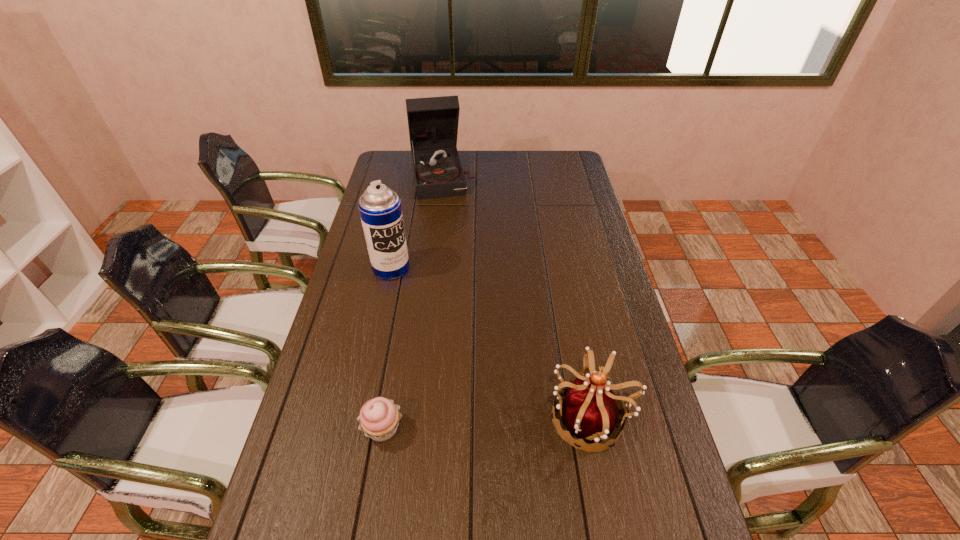
Where is `vacant space on the desktop that is between the cupcake and the rightmost object and is positioned on the label side of the aerosol can`? This screenshot has height=540, width=960. vacant space on the desktop that is between the cupcake and the rightmost object and is positioned on the label side of the aerosol can is located at coordinates (514, 421).

I want to click on vacant space on the desktop that is between the cupcake and the rightmost object and is positioned on the front-facing side of the phonograph_record, so click(x=496, y=422).